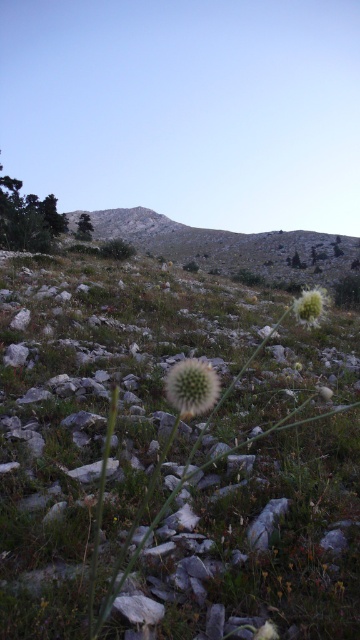
Describe the element at coordinates (236, 248) in the screenshot. This screenshot has height=640, width=360. I see `bare rock at upper center` at that location.

Looking at this image, can you confirm if bare rock at upper center is positioned above white fuzzy ball at upper right?

Indeed, bare rock at upper center is positioned over white fuzzy ball at upper right.

At what (x,y) coordinates should I click in order to perform the action: click on bare rock at upper center. Please return your answer as a coordinate pair (x, y). Looking at the image, I should click on (236, 248).

Where is `bare rock at upper center`? The width and height of the screenshot is (360, 640). bare rock at upper center is located at coordinates (236, 248).

Can you confirm if bare rock at upper center is positioned below white fuzzy ball at center?

Actually, bare rock at upper center is above white fuzzy ball at center.

Can you confirm if bare rock at upper center is wider than white fuzzy ball at center?

Yes, bare rock at upper center is wider than white fuzzy ball at center.

Who is more distant from viewer, (158, 248) or (196, 413)?

The point (158, 248) is behind.

This screenshot has width=360, height=640. I want to click on bare rock at upper center, so click(x=236, y=248).

Which is behind, point (186, 378) or point (306, 294)?

The point (306, 294) is behind.

Measure the distance between point [178,376] and camera.

Point [178,376] and camera are 1.34 meters apart from each other.

Identify the location of white fuzzy ball at center. The image size is (360, 640). (191, 387).